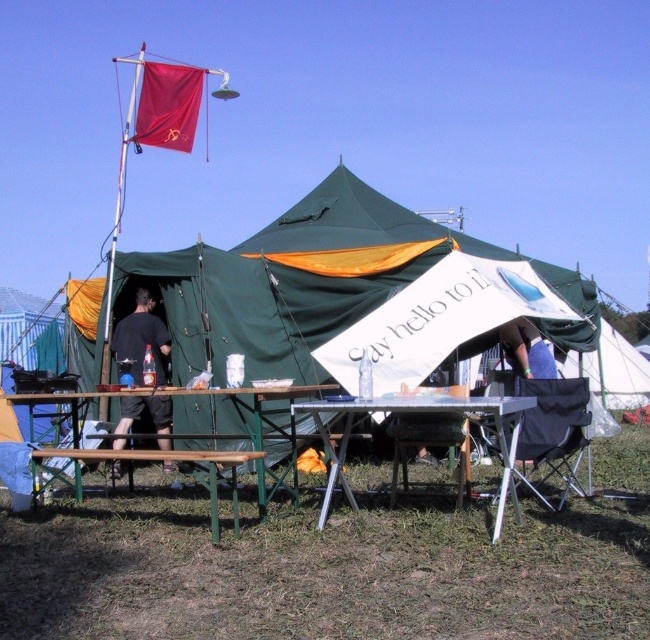
Question: Estimate the real-world distances between objects in this image. Which object is farther from the metallic silver table at center?

Choices:
 (A) red fabric flag at upper left
 (B) black fabric person at left
 (C) wooden chair at lower center
 (D) green canvas tent at center

Answer: (A)

Question: Does metallic silver table at center appear on the left side of wooden chair at lower center?

Choices:
 (A) yes
 (B) no

Answer: (A)

Question: Can you confirm if green metal table at center is positioned below wooden chair at lower center?

Choices:
 (A) yes
 (B) no

Answer: (B)

Question: Which point appears farthest from the camera in this image?

Choices:
 (A) (58, 456)
 (B) (44, 452)
 (C) (130, 316)

Answer: (C)

Question: In this image, where is metallic silver table at center located relative to brown wooden table at lower center?

Choices:
 (A) left
 (B) right

Answer: (B)

Question: Which of the following is the closest to the observer?

Choices:
 (A) green canvas tent at center
 (B) red fabric flag at upper left

Answer: (A)